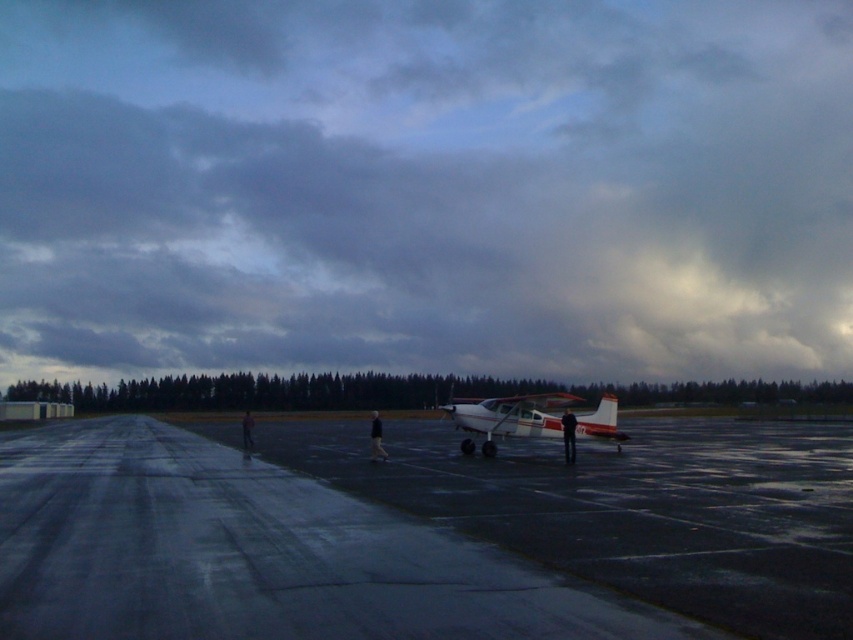
Is glossy asphalt tarmac at center wider than white matte airplane at center?

Correct, the width of glossy asphalt tarmac at center exceeds that of white matte airplane at center.

What are the coordinates of `glossy asphalt tarmac at center` in the screenshot? It's located at tap(250, 552).

Where is `glossy asphalt tarmac at center`? The height and width of the screenshot is (640, 853). glossy asphalt tarmac at center is located at coordinates (250, 552).

The height and width of the screenshot is (640, 853). I want to click on cloudy sky at upper center, so click(427, 186).

Which of these two, cloudy sky at upper center or white matte airplane at center, stands shorter?

white matte airplane at center is shorter.

Which is in front, point (724, 180) or point (529, 429)?

Point (529, 429) is in front.

Identify the location of cloudy sky at upper center. (427, 186).

Who is positioned more to the left, cloudy sky at upper center or glossy asphalt tarmac at center?

From the viewer's perspective, cloudy sky at upper center appears more on the left side.

Between point (694, 280) and point (695, 474), which one is positioned behind?

The point (694, 280) is behind.

Is point (747, 80) farther from camera compared to point (35, 609)?

Yes, it is.

Identify the location of cloudy sky at upper center. (427, 186).